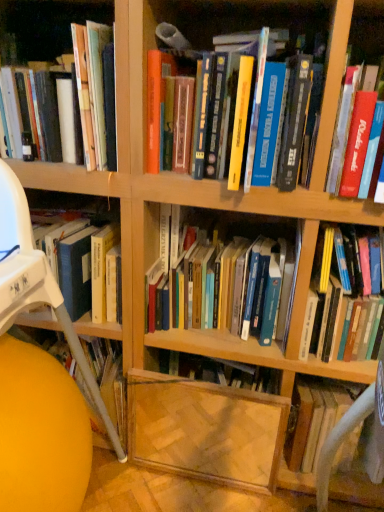
Question: From the image's perspective, is matte yellow ball at lower left positioned above or below white fabric computer chair at right?

Choices:
 (A) above
 (B) below

Answer: (A)

Question: Is matte yellow ball at lower left inside or outside of white fabric computer chair at right?

Choices:
 (A) outside
 (B) inside

Answer: (A)

Question: Based on their relative distances, which object is nearer to the white fabric computer chair at right?

Choices:
 (A) hardcover books at center, the second book when ordered from left to right
 (B) hardcover book at center right, which is counted as the 5th book, starting from the left
 (C) hardcover book at upper left, the 1th book from the left
 (D) hardcover books at center, the third book when ordered from left to right
 (E) wooden bookshelf at left, which ranks as the first shelf in left-to-right order

Answer: (B)

Question: Based on their relative distances, which object is nearer to the hardcover book at center right, which is counted as the 5th book, starting from the left?

Choices:
 (A) white fabric computer chair at right
 (B) transparent glass shelf at lower center, positioned as the 1th shelf in right-to-left order
 (C) hardcover books at center, the second book when ordered from left to right
 (D) hardcover books at center, the third book when ordered from right to left
 (E) wooden bookshelf at left, which ranks as the first shelf in left-to-right order

Answer: (D)